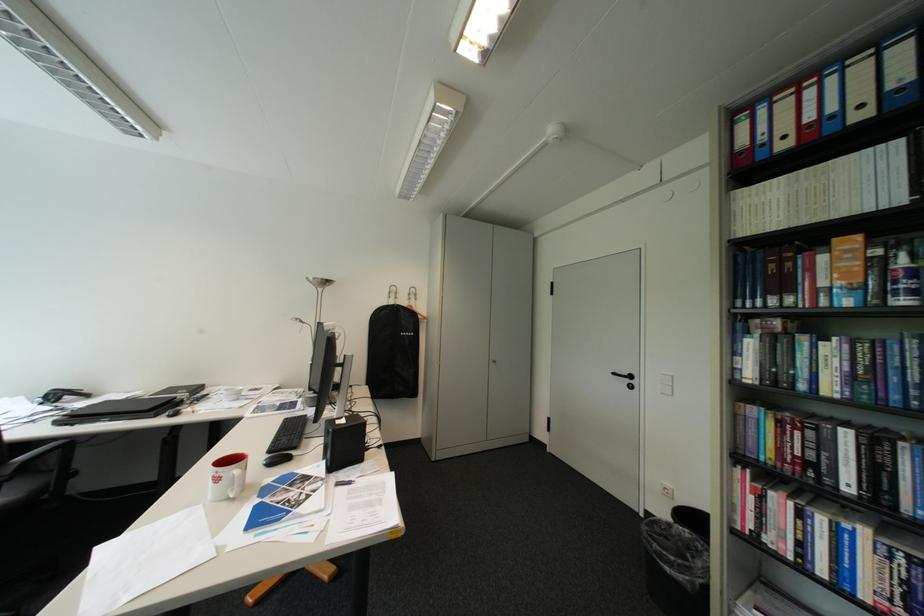
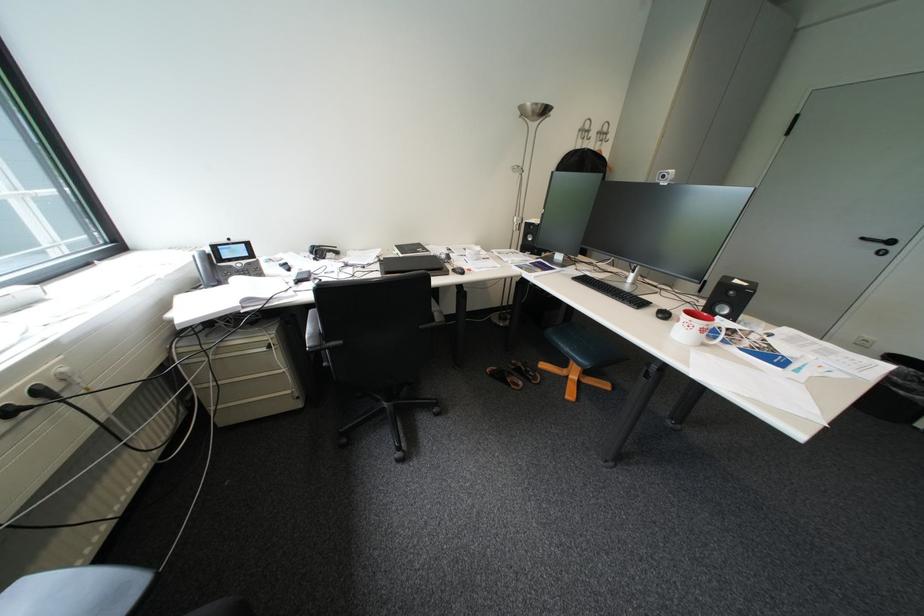
Find the pixel in the second image that matches the point at 642,377 in the first image.

(904, 243)